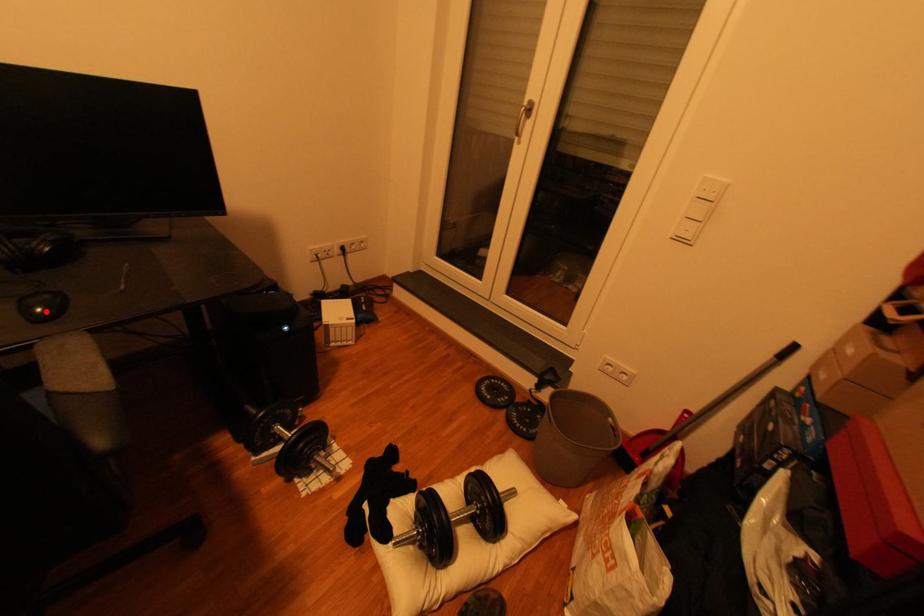
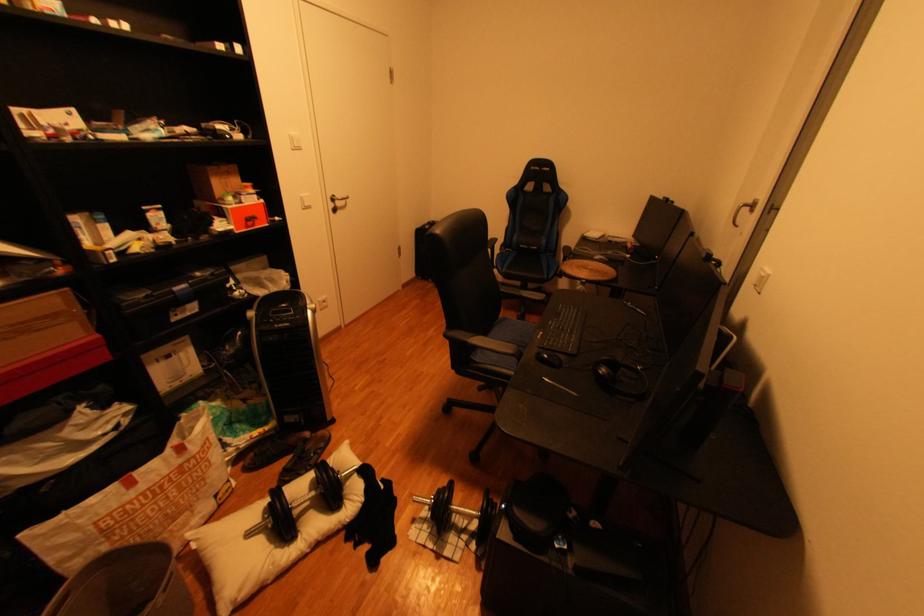
The point at the highlighted location is marked in the first image. Where is the corresponding point in the second image?

(555, 357)